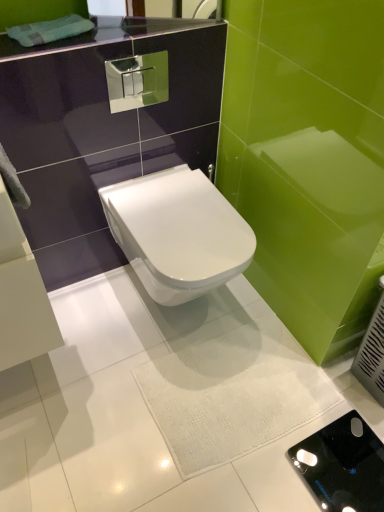
This screenshot has height=512, width=384. I want to click on vacant region below white glossy toilet at center (from a real-world perspective), so click(196, 320).